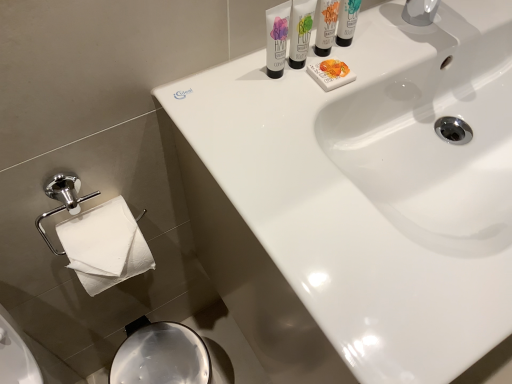
What do you see at coordinates (347, 21) in the screenshot? I see `matte white shaving cream at upper right, which is the 1th shaving cream in right-to-left order` at bounding box center [347, 21].

What is the approximate height of white glossy tube at upper center, arranged as the third shaving cream when viewed from the right?

white glossy tube at upper center, arranged as the third shaving cream when viewed from the right, is 9.63 centimeters tall.

This screenshot has height=384, width=512. I want to click on white matte soap at upper center, so click(x=330, y=74).

Image resolution: width=512 pixels, height=384 pixels. In order to click on matte white shaving cream at upper right, which is the 1th shaving cream in right-to-left order in this screenshot , I will do `click(347, 21)`.

Is white matte soap at upper center thinner than white glossy sink at upper center?

Indeed, white matte soap at upper center has a lesser width compared to white glossy sink at upper center.

Which object is closer to the camera, white matte soap at upper center or white glossy sink at upper center?

Positioned in front is white glossy sink at upper center.

Can you confirm if white matte soap at upper center is smaller than white glossy sink at upper center?

Correct, white matte soap at upper center occupies less space than white glossy sink at upper center.

Is white matte soap at upper center far away from white glossy sink at upper center?

Actually, white matte soap at upper center and white glossy sink at upper center are a little close together.

I want to click on soap that is on the left side of matte white shaving cream at upper right, the 3th shaving cream from the left, so (x=330, y=74).

From the image's perspective, between matte white shaving cream at upper right, the 3th shaving cream from the left, and white matte soap at upper center, who is located below?

white matte soap at upper center.

Is matte white shaving cream at upper right, the 3th shaving cream from the left, facing towards white matte soap at upper center?

No.

In the scene shown: From a real-world perspective, is matte white shaving cream at upper right, the 3th shaving cream from the left, located higher than white matte soap at upper center?

Yes, from a real-world perspective, matte white shaving cream at upper right, the 3th shaving cream from the left, is on top of white matte soap at upper center.

Is matte white shaving cream at upper center, the second shaving cream in the right-to-left sequence, beside matte white shaving cream at upper right, the 3th shaving cream from the left?

Yes, the surface of matte white shaving cream at upper center, the second shaving cream in the right-to-left sequence, is in contact with matte white shaving cream at upper right, the 3th shaving cream from the left.

Is matte white shaving cream at upper center, the second shaving cream in the right-to-left sequence, completely or partially outside of matte white shaving cream at upper right, which is the 1th shaving cream in right-to-left order?

matte white shaving cream at upper center, the second shaving cream in the right-to-left sequence, lies outside matte white shaving cream at upper right, which is the 1th shaving cream in right-to-left order,'s area.

Considering their positions, is matte white shaving cream at upper center, the second shaving cream in the right-to-left sequence, located in front of or behind matte white shaving cream at upper right, the 3th shaving cream from the left?

Clearly, matte white shaving cream at upper center, the second shaving cream in the right-to-left sequence, is in front of matte white shaving cream at upper right, the 3th shaving cream from the left.

Considering the positions of points (293, 30) and (356, 7), is point (293, 30) closer to camera compared to point (356, 7)?

That is True.

From the picture: Which is more to the left, white glossy sink at upper center or white glossy tube at upper center, arranged as the 1th shaving cream when viewed from the left?

Positioned to the left is white glossy tube at upper center, arranged as the 1th shaving cream when viewed from the left.

Which is in front, point (308, 369) or point (283, 51)?

Positioned in front is point (308, 369).

From the picture: Considering the sizes of white glossy sink at upper center and white glossy tube at upper center, arranged as the third shaving cream when viewed from the right, in the image, is white glossy sink at upper center wider or thinner than white glossy tube at upper center, arranged as the third shaving cream when viewed from the right,?

Clearly, white glossy sink at upper center has more width compared to white glossy tube at upper center, arranged as the third shaving cream when viewed from the right.

Is white glossy sink at upper center facing away from white glossy tube at upper center, arranged as the third shaving cream when viewed from the right?

white glossy sink at upper center does not have its back to white glossy tube at upper center, arranged as the third shaving cream when viewed from the right.

Is matte white shaving cream at upper center, the second shaving cream in the right-to-left sequence, in front of or behind white glossy tube at upper center, arranged as the 1th shaving cream when viewed from the left, in the image?

Visually, matte white shaving cream at upper center, the second shaving cream in the right-to-left sequence, is located behind white glossy tube at upper center, arranged as the 1th shaving cream when viewed from the left.

Is matte white shaving cream at upper center, the second shaving cream in the right-to-left sequence, inside the boundaries of white glossy tube at upper center, arranged as the third shaving cream when viewed from the right, or outside?

matte white shaving cream at upper center, the second shaving cream in the right-to-left sequence, lies outside white glossy tube at upper center, arranged as the third shaving cream when viewed from the right.

Can you confirm if matte white shaving cream at upper center, the second shaving cream in the right-to-left sequence, is thinner than white glossy tube at upper center, arranged as the third shaving cream when viewed from the right?

No.

Could you tell me if matte white shaving cream at upper center, the 2th shaving cream viewed from the left, is facing white glossy tube at upper center, arranged as the third shaving cream when viewed from the right?

No, matte white shaving cream at upper center, the 2th shaving cream viewed from the left, is not aimed at white glossy tube at upper center, arranged as the third shaving cream when viewed from the right.

In the scene shown: Can you tell me how much white matte soap at upper center and matte white shaving cream at upper center, the second shaving cream in the right-to-left sequence, differ in facing direction?

The angle between the facing direction of white matte soap at upper center and the facing direction of matte white shaving cream at upper center, the second shaving cream in the right-to-left sequence, is 6.39 degrees.

From the image's perspective, is white matte soap at upper center located beneath matte white shaving cream at upper center, the 2th shaving cream viewed from the left?

Yes, from the image's perspective, white matte soap at upper center is below matte white shaving cream at upper center, the 2th shaving cream viewed from the left.

I want to click on soap on the right of the matte white shaving cream at upper center, the 2th shaving cream viewed from the left, so click(x=330, y=74).

Is white matte soap at upper center taller than matte white shaving cream at upper center, the 2th shaving cream viewed from the left?

Incorrect, the height of white matte soap at upper center is not larger of that of matte white shaving cream at upper center, the 2th shaving cream viewed from the left.

Considering the sizes of objects white glossy sink at upper center and matte white shaving cream at upper right, the 3th shaving cream from the left, in the image provided, who is taller, white glossy sink at upper center or matte white shaving cream at upper right, the 3th shaving cream from the left,?

Standing taller between the two is white glossy sink at upper center.

In terms of size, does white glossy sink at upper center appear bigger or smaller than matte white shaving cream at upper right, which is the 1th shaving cream in right-to-left order?

Clearly, white glossy sink at upper center is larger in size than matte white shaving cream at upper right, which is the 1th shaving cream in right-to-left order.

Consider the image. From a real-world perspective, between white glossy sink at upper center and matte white shaving cream at upper right, which is the 1th shaving cream in right-to-left order, who is vertically higher?

In real-world perspective, matte white shaving cream at upper right, which is the 1th shaving cream in right-to-left order, is above.

Locate an element on the screen. soap on the left of white glossy sink at upper center is located at coordinates (330, 74).

Where is `soap behind the matte white shaving cream at upper right, which is the 1th shaving cream in right-to-left order`? soap behind the matte white shaving cream at upper right, which is the 1th shaving cream in right-to-left order is located at coordinates (330, 74).

Estimate the real-world distances between objects in this image. Which object is closer to white matte soap at upper center, white glossy tube at upper center, arranged as the third shaving cream when viewed from the right, or matte white shaving cream at upper center, the second shaving cream in the right-to-left sequence?

The object closer to white matte soap at upper center is matte white shaving cream at upper center, the second shaving cream in the right-to-left sequence.

Based on their spatial positions, is matte white shaving cream at upper right, the 3th shaving cream from the left, or white glossy tube at upper center, arranged as the third shaving cream when viewed from the right, further from matte white shaving cream at upper center, the 2th shaving cream viewed from the left?

matte white shaving cream at upper right, the 3th shaving cream from the left.

Considering their positions, is white matte soap at upper center positioned further to white glossy tube at upper center, arranged as the 1th shaving cream when viewed from the left, than white glossy sink at upper center?

Based on the image, white glossy sink at upper center appears to be further to white glossy tube at upper center, arranged as the 1th shaving cream when viewed from the left.

Looking at the image, which one is located closer to matte white shaving cream at upper center, the second shaving cream in the right-to-left sequence, white glossy sink at upper center or matte white shaving cream at upper right, which is the 1th shaving cream in right-to-left order?

The object closer to matte white shaving cream at upper center, the second shaving cream in the right-to-left sequence, is matte white shaving cream at upper right, which is the 1th shaving cream in right-to-left order.

Looking at the image, which one is located closer to matte white shaving cream at upper center, the second shaving cream in the right-to-left sequence, white matte soap at upper center or matte white shaving cream at upper right, the 3th shaving cream from the left?

Based on the image, white matte soap at upper center appears to be nearer to matte white shaving cream at upper center, the second shaving cream in the right-to-left sequence.

Which object lies further to the anchor point white matte soap at upper center, white glossy tube at upper center, arranged as the third shaving cream when viewed from the right, or matte white shaving cream at upper right, the 3th shaving cream from the left?

Among the two, matte white shaving cream at upper right, the 3th shaving cream from the left, is located further to white matte soap at upper center.

Considering their positions, is white matte soap at upper center positioned closer to white glossy sink at upper center than matte white shaving cream at upper center, the second shaving cream in the right-to-left sequence?

Based on the image, white matte soap at upper center appears to be nearer to white glossy sink at upper center.

Estimate the real-world distances between objects in this image. Which object is further from white matte soap at upper center, white glossy sink at upper center or matte white shaving cream at upper right, which is the 1th shaving cream in right-to-left order?

white glossy sink at upper center is positioned further to the anchor white matte soap at upper center.

The height and width of the screenshot is (384, 512). I want to click on shaving cream between matte white shaving cream at upper center, the 2th shaving cream viewed from the left, and white glossy sink at upper center, so click(347, 21).

Find the location of a particular element. This screenshot has height=384, width=512. soap between white glossy tube at upper center, arranged as the 1th shaving cream when viewed from the left, and matte white shaving cream at upper right, which is the 1th shaving cream in right-to-left order, from left to right is located at coordinates (330, 74).

I want to click on shaving cream between white glossy tube at upper center, arranged as the third shaving cream when viewed from the right, and white matte soap at upper center, in the horizontal direction, so click(301, 31).

In order to click on shaving cream located between white glossy tube at upper center, arranged as the 1th shaving cream when viewed from the left, and matte white shaving cream at upper right, which is the 1th shaving cream in right-to-left order, in the left-right direction in this screenshot , I will do `click(301, 31)`.